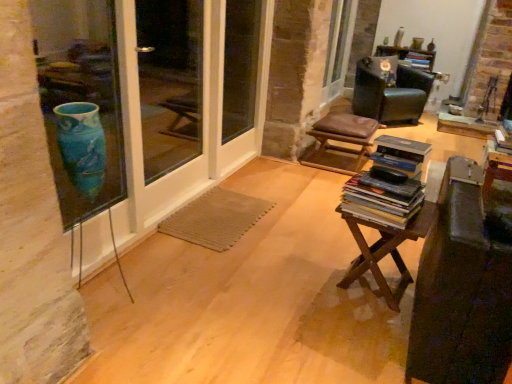
Question: Is wooden at center smaller than brown leather stool at center?

Choices:
 (A) yes
 (B) no

Answer: (A)

Question: Considering the relative sizes of wooden at center and brown leather stool at center in the image provided, is wooden at center wider than brown leather stool at center?

Choices:
 (A) yes
 (B) no

Answer: (B)

Question: Is wooden at center positioned before brown leather stool at center?

Choices:
 (A) yes
 (B) no

Answer: (A)

Question: Is the depth of wooden at center greater than that of brown leather stool at center?

Choices:
 (A) no
 (B) yes

Answer: (A)

Question: Is wooden at center looking in the opposite direction of brown leather stool at center?

Choices:
 (A) no
 (B) yes

Answer: (A)

Question: Would you say brown leather stool at center is part of wooden at center's contents?

Choices:
 (A) no
 (B) yes

Answer: (A)

Question: Is the surface of clear glass screen door at left in direct contact with wooden at center?

Choices:
 (A) yes
 (B) no

Answer: (B)

Question: Could wooden at center be considered to be inside clear glass screen door at left?

Choices:
 (A) no
 (B) yes

Answer: (A)

Question: Considering the relative positions of clear glass screen door at left and wooden at center in the image provided, is clear glass screen door at left to the right of wooden at center from the viewer's perspective?

Choices:
 (A) no
 (B) yes

Answer: (A)

Question: From a real-world perspective, is clear glass screen door at left under wooden at center?

Choices:
 (A) no
 (B) yes

Answer: (A)

Question: Can we say clear glass screen door at left lies outside wooden at center?

Choices:
 (A) yes
 (B) no

Answer: (A)

Question: Could you tell me if clear glass screen door at left is facing wooden at center?

Choices:
 (A) yes
 (B) no

Answer: (A)

Question: From the image's perspective, is wooden at center on top of clear glass screen door at left?

Choices:
 (A) yes
 (B) no

Answer: (B)